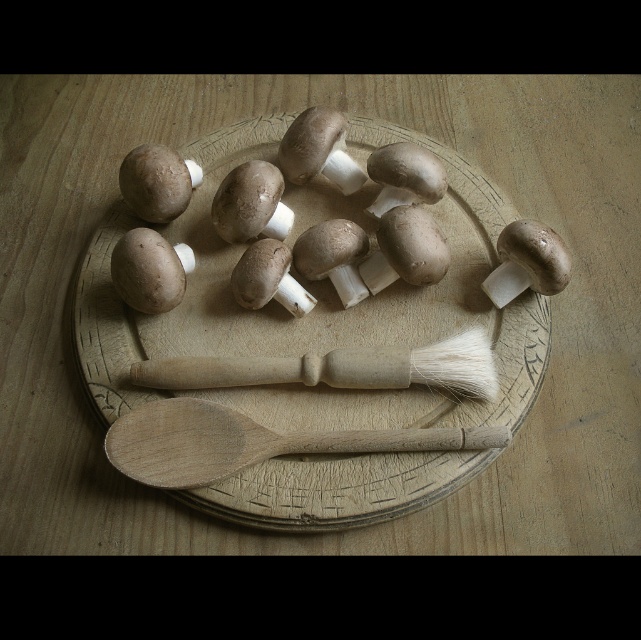
From the picture: Is wooden plate at center above wooden spoon at lower center?

Yes, wooden plate at center is above wooden spoon at lower center.

The image size is (641, 640). I want to click on wooden plate at center, so click(x=313, y=308).

Can you confirm if wooden plate at center is positioned below white bristle brush at center?

Incorrect, wooden plate at center is not positioned below white bristle brush at center.

Is wooden plate at center positioned at the back of white bristle brush at center?

No, wooden plate at center is in front of white bristle brush at center.

Locate an element on the screen. The height and width of the screenshot is (640, 641). wooden plate at center is located at coordinates (313, 308).

This screenshot has height=640, width=641. What are the coordinates of `wooden plate at center` in the screenshot? It's located at [x=313, y=308].

Consider the image. Is the position of wooden spoon at lower center more distant than that of white bristle brush at center?

No, it is in front of white bristle brush at center.

Image resolution: width=641 pixels, height=640 pixels. Describe the element at coordinates (249, 442) in the screenshot. I see `wooden spoon at lower center` at that location.

Is point (431, 444) farther from camera compared to point (478, 340)?

No, (431, 444) is in front of (478, 340).

The image size is (641, 640). I want to click on wooden spoon at lower center, so click(249, 442).